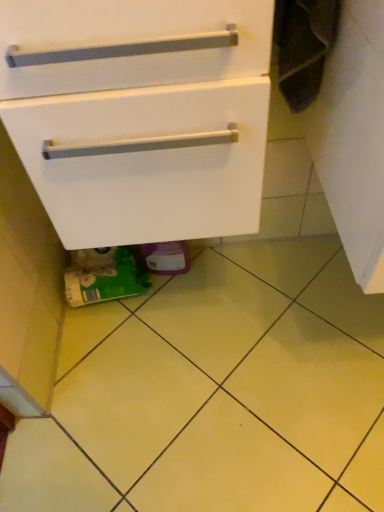
Question: From a real-world perspective, is white matte cabinet at center located higher than yellow matte tile at lower center?

Choices:
 (A) no
 (B) yes

Answer: (B)

Question: Are white matte cabinet at center and yellow matte tile at lower center located far from each other?

Choices:
 (A) no
 (B) yes

Answer: (A)

Question: Is white matte cabinet at center outside yellow matte tile at lower center?

Choices:
 (A) no
 (B) yes

Answer: (B)

Question: Is white matte cabinet at center to the right of yellow matte tile at lower center from the viewer's perspective?

Choices:
 (A) yes
 (B) no

Answer: (B)

Question: From the image's perspective, is white matte cabinet at center beneath yellow matte tile at lower center?

Choices:
 (A) no
 (B) yes

Answer: (A)

Question: Is white matte cabinet at center further to camera compared to yellow matte tile at lower center?

Choices:
 (A) no
 (B) yes

Answer: (A)

Question: Would you say yellow matte tile at lower center is a long distance from white matte cabinet at center?

Choices:
 (A) no
 (B) yes

Answer: (A)

Question: Is the surface of yellow matte tile at lower center in direct contact with white matte cabinet at center?

Choices:
 (A) no
 (B) yes

Answer: (A)

Question: Considering the relative sizes of yellow matte tile at lower center and white matte cabinet at center in the image provided, is yellow matte tile at lower center bigger than white matte cabinet at center?

Choices:
 (A) no
 (B) yes

Answer: (A)

Question: Does yellow matte tile at lower center have a greater width compared to white matte cabinet at center?

Choices:
 (A) yes
 (B) no

Answer: (A)

Question: Does yellow matte tile at lower center appear on the left side of white matte cabinet at center?

Choices:
 (A) no
 (B) yes

Answer: (A)

Question: Is yellow matte tile at lower center shorter than white matte cabinet at center?

Choices:
 (A) no
 (B) yes

Answer: (B)

Question: From the image's perspective, is white matte cabinet at center above or below yellow matte tile at lower center?

Choices:
 (A) above
 (B) below

Answer: (A)